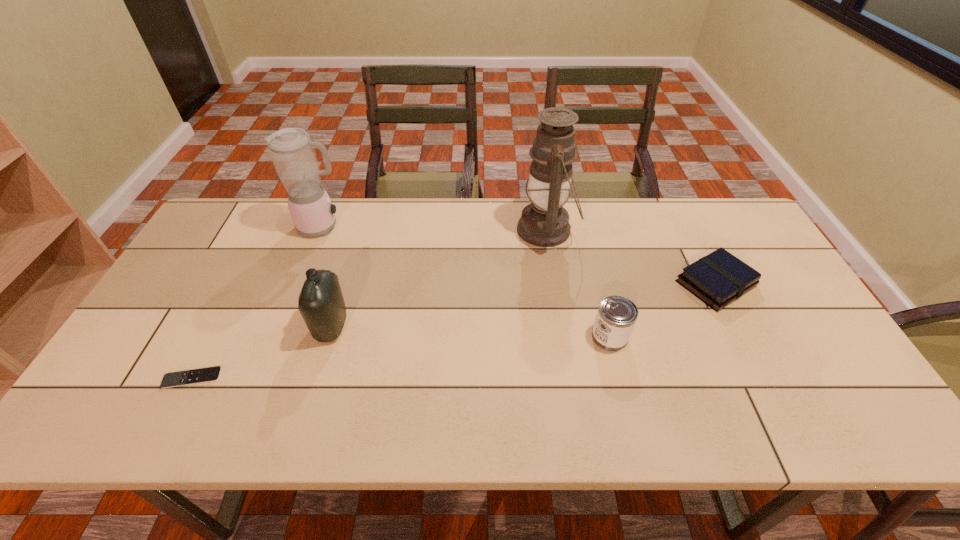
Locate an element on the screen. The height and width of the screenshot is (540, 960). free space at the far edge of the desktop is located at coordinates (300, 236).

The width and height of the screenshot is (960, 540). Find the location of `free space at the near edge of the desktop`. free space at the near edge of the desktop is located at coordinates (463, 417).

Where is `free spot at the left edge of the desktop`? The height and width of the screenshot is (540, 960). free spot at the left edge of the desktop is located at coordinates (216, 259).

This screenshot has width=960, height=540. In order to click on free region at the right edge of the desktop in this screenshot , I will do `click(791, 313)`.

Identify the location of free spot at the far left corner of the desktop. This screenshot has height=540, width=960. (x=226, y=212).

Find the location of a particular element. vacant region between the third tallest object and the shortest object is located at coordinates tap(262, 352).

At what (x,y) coordinates should I click in order to perform the action: click on vacant area that lies between the remote control and the can. Please return your answer as a coordinate pair (x, y). Looking at the image, I should click on (401, 357).

The image size is (960, 540). Find the location of `blank region between the fourth object from right to left and the fourth tallest object`. blank region between the fourth object from right to left and the fourth tallest object is located at coordinates (470, 332).

This screenshot has height=540, width=960. In order to click on free space between the second shortest object and the fifth shortest object in this screenshot , I will do `click(519, 255)`.

Find the location of a particular element. This screenshot has width=960, height=540. free point between the fourth object from right to left and the leftmost object is located at coordinates (262, 352).